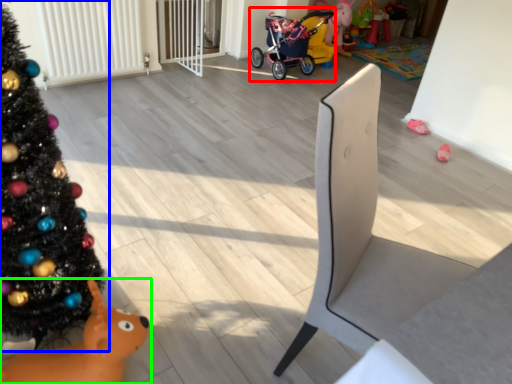
Question: Which is farther away from baby carriage (highlighted by a red box)? christmas tree (highlighted by a blue box) or toy (highlighted by a green box)?

Choices:
 (A) christmas tree
 (B) toy

Answer: (B)